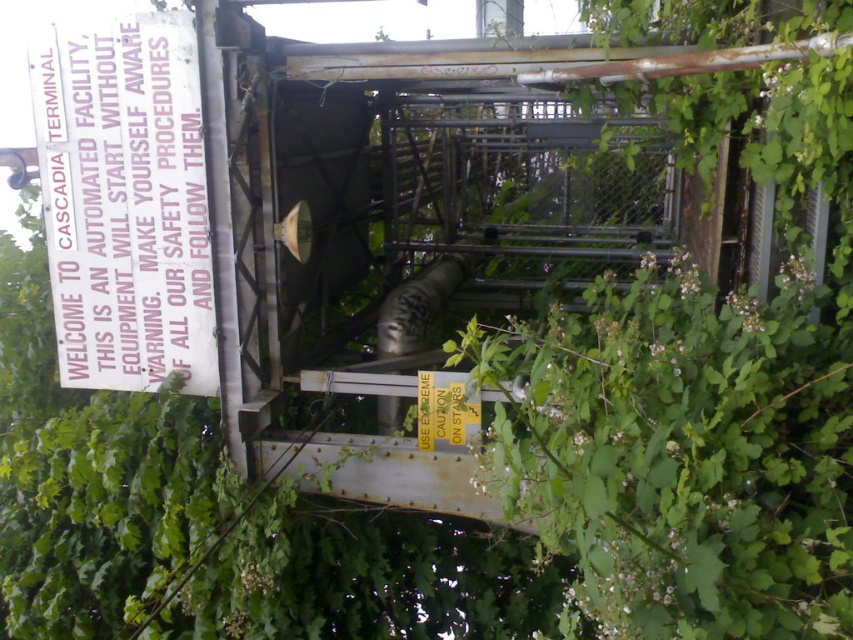
Who is more distant from viewer, (161, 160) or (459, 387)?

The point (161, 160) is more distant.

This screenshot has height=640, width=853. In order to click on white paper sign at left in this screenshot , I will do `click(125, 200)`.

I want to click on white paper sign at left, so click(x=125, y=200).